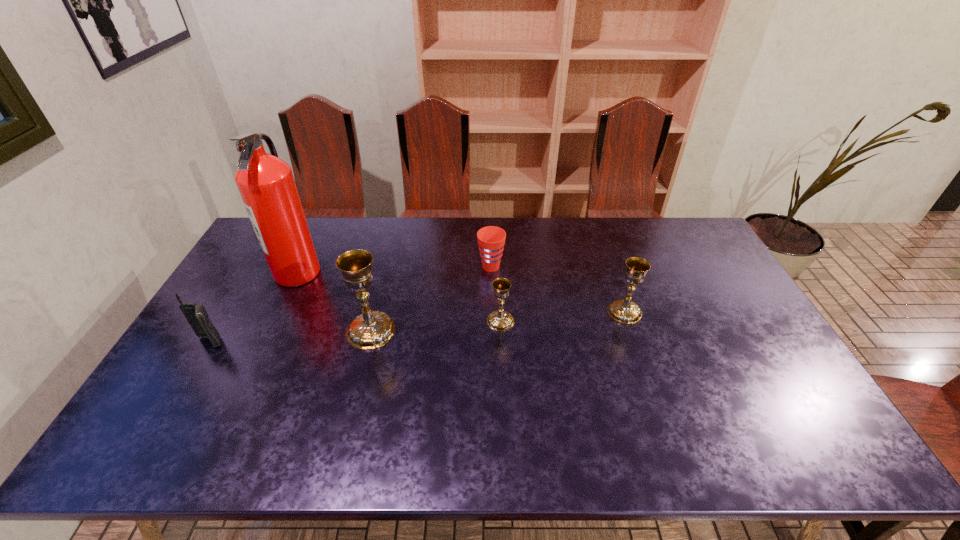
In order to click on vacant area situated on the front of the second chalice from right to left in this screenshot , I will do `click(504, 386)`.

This screenshot has width=960, height=540. I want to click on free space located on the right of the rightmost chalice, so click(x=682, y=312).

Identify the location of free space located 0.290m at the nozzle of the fifth object from right to left. The image size is (960, 540). (406, 272).

The width and height of the screenshot is (960, 540). Find the location of `vacant space situated 0.310m on the left of the cup`. vacant space situated 0.310m on the left of the cup is located at coordinates (387, 267).

You are a GUI agent. You are given a task and a screenshot of the screen. Output one action in this format:
    pyautogui.click(x=<x>, y=<y>)
    Task: Click on the vacant space situated 0.200m on the keyboard of the leftmost object
    The width and height of the screenshot is (960, 540).
    Given the screenshot: What is the action you would take?
    pyautogui.click(x=167, y=413)

The width and height of the screenshot is (960, 540). Identify the location of object that is at the far edge. (266, 184).

Locate an element on the screen. Image resolution: width=960 pixels, height=540 pixels. fire extinguisher that is at the left edge is located at coordinates (266, 184).

This screenshot has width=960, height=540. In order to click on cellular telephone present at the left edge in this screenshot , I will do `click(196, 315)`.

Where is `object that is at the far left corner`? This screenshot has height=540, width=960. object that is at the far left corner is located at coordinates (266, 184).

This screenshot has width=960, height=540. I want to click on vacant space at the far edge of the desktop, so [x=316, y=223].